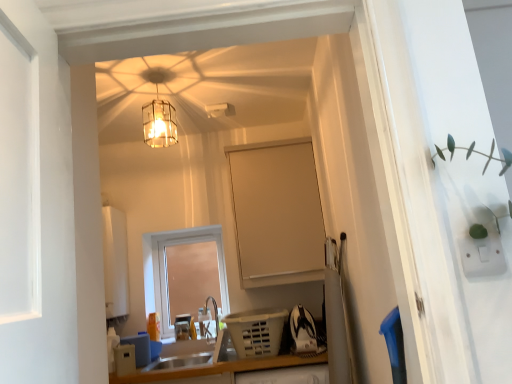
Describe the element at coordinates (159, 113) in the screenshot. I see `translucent glass lampshade at upper center` at that location.

In order to face matte white window at center, should I rotate leftwards or rightwards?

Turn left approximately 8.875 degrees to face it.

At what (x,y) coordinates should I click in order to perform the action: click on matte white window at center. Please return your answer as a coordinate pair (x, y). Looking at the image, I should click on (166, 270).

Where is `white plastic speaker at lower left, the 1th appliance viewed from the left`? The image size is (512, 384). white plastic speaker at lower left, the 1th appliance viewed from the left is located at coordinates (124, 359).

Measure the distance between point (278, 242) and camera.

They are 2.89 meters apart.

You are a GUI agent. You are given a task and a screenshot of the screen. Output one action in this format:
    pyautogui.click(x=<x>, y=<y>)
    Task: Click on the white plastic laundry basket at lower center, which is the second appliance in left-to-right order
    The width and height of the screenshot is (512, 384).
    Given the screenshot: What is the action you would take?
    pyautogui.click(x=256, y=331)

Considering the positions of point (241, 201) and point (123, 370), is point (241, 201) closer or farther from the camera than point (123, 370)?

Point (241, 201) appears to be farther away from the viewer than point (123, 370).

Could you tell me if beige matte cabinet at center is turned towards white plastic speaker at lower left, the 2th appliance when ordered from right to left?

No, beige matte cabinet at center is not oriented towards white plastic speaker at lower left, the 2th appliance when ordered from right to left.

Image resolution: width=512 pixels, height=384 pixels. Find the location of `the 2nd appliance located beneath the beige matte cabinet at center (from a real-world perspective)`. the 2nd appliance located beneath the beige matte cabinet at center (from a real-world perspective) is located at coordinates (124, 359).

Between beige matte cabinet at center and white plastic speaker at lower left, the 2th appliance when ordered from right to left, which one has smaller size?

Smaller between the two is white plastic speaker at lower left, the 2th appliance when ordered from right to left.

Is matte white window at center not inside white plastic speaker at lower left, the 2th appliance when ordered from right to left?

matte white window at center lies outside white plastic speaker at lower left, the 2th appliance when ordered from right to left,'s area.

Is matte white window at center at the left side of white plastic speaker at lower left, the 2th appliance when ordered from right to left?

Incorrect, matte white window at center is not on the left side of white plastic speaker at lower left, the 2th appliance when ordered from right to left.

What are the coordinates of `window above the white plastic speaker at lower left, the 1th appliance viewed from the left (from a real-world perspective)` in the screenshot? It's located at (166, 270).

From a real-world perspective, is matte white window at center over white plastic speaker at lower left, the 1th appliance viewed from the left?

Yes.

From a real-world perspective, is matte white window at center positioned above or below translucent glass lampshade at upper center?

Clearly, from a real-world perspective, matte white window at center is below translucent glass lampshade at upper center.

Is matte white window at center outside of translucent glass lampshade at upper center?

Indeed, matte white window at center is completely outside translucent glass lampshade at upper center.

Does matte white window at center have a larger size compared to translucent glass lampshade at upper center?

Indeed, matte white window at center has a larger size compared to translucent glass lampshade at upper center.

From the image's perspective, does matte white window at center appear higher than translucent glass lampshade at upper center?

Actually, matte white window at center appears below translucent glass lampshade at upper center in the image.

Is satin silver sink at lower center not inside white plastic speaker at lower left, the 1th appliance viewed from the left?

Yes.

Is satin silver sink at lower center to the right of white plastic speaker at lower left, the 1th appliance viewed from the left, from the viewer's perspective?

Correct, you'll find satin silver sink at lower center to the right of white plastic speaker at lower left, the 1th appliance viewed from the left.

From the image's perspective, is satin silver sink at lower center under white plastic speaker at lower left, the 2th appliance when ordered from right to left?

Correct, satin silver sink at lower center appears lower than white plastic speaker at lower left, the 2th appliance when ordered from right to left, in the image.

Is satin silver sink at lower center bigger than white plastic speaker at lower left, the 1th appliance viewed from the left?

Yes, satin silver sink at lower center is bigger than white plastic speaker at lower left, the 1th appliance viewed from the left.

Would you say beige matte cabinet at center is inside or outside translucent glass lampshade at upper center?

beige matte cabinet at center is located beyond the bounds of translucent glass lampshade at upper center.

Does beige matte cabinet at center have a greater height compared to translucent glass lampshade at upper center?

Indeed, beige matte cabinet at center has a greater height compared to translucent glass lampshade at upper center.

Which of these two, beige matte cabinet at center or translucent glass lampshade at upper center, is wider?

beige matte cabinet at center.

I want to click on lamp that is above the beige matte cabinet at center (from a real-world perspective), so click(159, 113).

Do you think matte white window at center is within satin silver sink at lower center, or outside of it?

matte white window at center cannot be found inside satin silver sink at lower center.

Consider the image. Relative to satin silver sink at lower center, is matte white window at center in front or behind?

In the image, matte white window at center appears behind satin silver sink at lower center.

Considering the positions of objects matte white window at center and satin silver sink at lower center in the image provided, who is more to the right, matte white window at center or satin silver sink at lower center?

Positioned to the right is satin silver sink at lower center.

Does matte white window at center have a lesser width compared to satin silver sink at lower center?

Indeed, matte white window at center has a lesser width compared to satin silver sink at lower center.

From the beige matte cabinet at center, count the 1st appliance to the left and point to it. Please provide its 2D coordinates.

[(256, 331)]

In the scene shown: From a real-world perspective, is beige matte cabinet at center over white plastic laundry basket at lower center, the first appliance in the right-to-left sequence?

Correct, in the physical world, beige matte cabinet at center is higher than white plastic laundry basket at lower center, the first appliance in the right-to-left sequence.

What's the angular difference between beige matte cabinet at center and white plastic laundry basket at lower center, the first appliance in the right-to-left sequence,'s facing directions?

0.0117 degrees separate the facing orientations of beige matte cabinet at center and white plastic laundry basket at lower center, the first appliance in the right-to-left sequence.

This screenshot has width=512, height=384. I want to click on cabinetry located above the white plastic speaker at lower left, the 1th appliance viewed from the left (from the image's perspective), so point(277,215).

Where is `appliance on the left of matte white window at center`? The width and height of the screenshot is (512, 384). appliance on the left of matte white window at center is located at coordinates tap(124, 359).

Considering their positions, is white plastic laundry basket at lower center, the first appliance in the right-to-left sequence, positioned further to satin silver sink at lower center than beige matte cabinet at center?

beige matte cabinet at center.

Which object lies nearer to the anchor point beige matte cabinet at center, matte white window at center or white plastic laundry basket at lower center, which is the second appliance in left-to-right order?

Based on the image, white plastic laundry basket at lower center, which is the second appliance in left-to-right order, appears to be nearer to beige matte cabinet at center.

Estimate the real-world distances between objects in this image. Which object is closer to matte white window at center, translucent glass lampshade at upper center or white plastic speaker at lower left, the 1th appliance viewed from the left?

white plastic speaker at lower left, the 1th appliance viewed from the left, is positioned closer to the anchor matte white window at center.

Based on their spatial positions, is white plastic speaker at lower left, the 2th appliance when ordered from right to left, or matte white window at center closer to translucent glass lampshade at upper center?

matte white window at center.

Looking at the image, which one is located further to translucent glass lampshade at upper center, beige matte cabinet at center or satin silver sink at lower center?

satin silver sink at lower center.

Considering their positions, is beige matte cabinet at center positioned closer to white plastic laundry basket at lower center, which is the second appliance in left-to-right order, than satin silver sink at lower center?

satin silver sink at lower center is closer to white plastic laundry basket at lower center, which is the second appliance in left-to-right order.

Looking at the image, which one is located closer to white plastic speaker at lower left, the 1th appliance viewed from the left, beige matte cabinet at center or satin silver sink at lower center?

Among the two, satin silver sink at lower center is located nearer to white plastic speaker at lower left, the 1th appliance viewed from the left.

When comparing their distances from translucent glass lampshade at upper center, does matte white window at center or satin silver sink at lower center seem further?

Based on the image, satin silver sink at lower center appears to be further to translucent glass lampshade at upper center.

The image size is (512, 384). Find the location of `cabinetry between translucent glass lampshade at upper center and matte white window at center in the up-down direction`. cabinetry between translucent glass lampshade at upper center and matte white window at center in the up-down direction is located at coordinates (277, 215).

Locate an element on the screen. sink between white plastic speaker at lower left, the 2th appliance when ordered from right to left, and matte white window at center, along the z-axis is located at coordinates (180, 362).

This screenshot has width=512, height=384. Identify the location of appliance between white plastic speaker at lower left, the 1th appliance viewed from the left, and beige matte cabinet at center. (256, 331).

Find the location of a particular element. sink located between white plastic laundry basket at lower center, the first appliance in the right-to-left sequence, and matte white window at center in the depth direction is located at coordinates (180, 362).